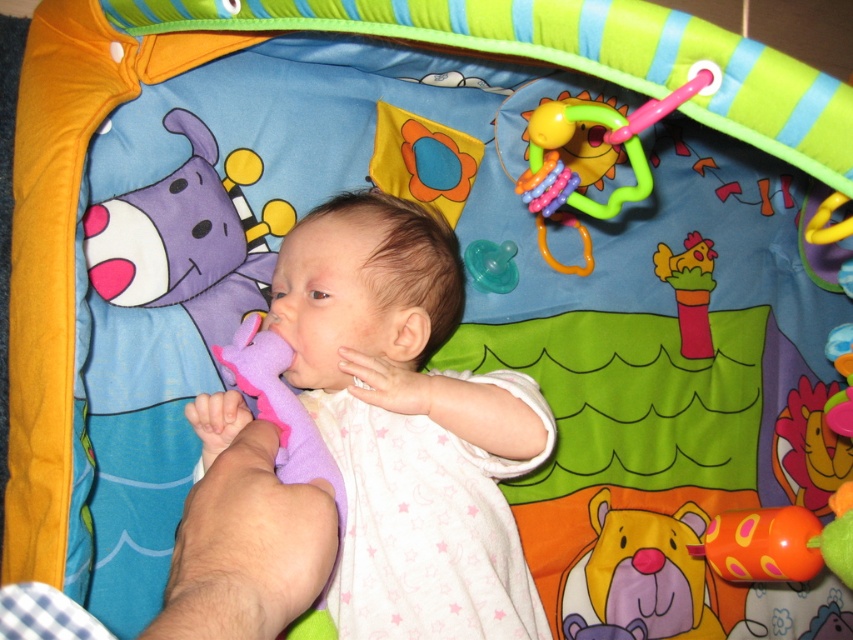
You are a parent trying to choose a toy for your baby. The baby is currently lying in the playpen and looking upwards. You have two options in the center of the playpen, the purple soft plush bear at center and the purple rubber teething ring at center. Which toy is taller?

The purple soft plush bear at center is taller than the purple rubber teething ring at center.

Based on the photo, you are a photographer trying to capture a closeup of the baby in the playpen. You notice two points marked in the image at coordinates point (x=602, y=545) and point (x=358, y=385). Which point should you focus on to ensure the baby is in focus?

You should focus on point (x=602, y=545) because it is closer to the baby compared to point (x=358, y=385), ensuring the baby is in focus.

You are a parent holding a baby in a playpen. The baby is looking at the pink rubber teething ring at upper center. If you want to move the ring closer to the baby, which direction should you move it from the current position?

The pink rubber teething ring at upper center is located at coordinates 0.223 on the x axis and 0.712 on the y axis. To move it closer to the baby, you should move it downward since the baby is looking slightly upwards and the ring is positioned above the baby.